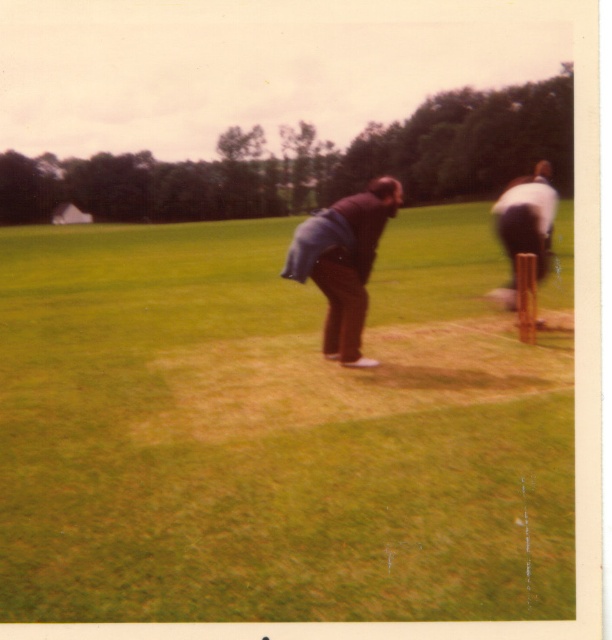
Question: Is green grass at center below white fabric shirt at right?

Choices:
 (A) yes
 (B) no

Answer: (A)

Question: Where is green grass at center located in relation to white fabric shirt at right in the image?

Choices:
 (A) above
 (B) below

Answer: (B)

Question: Is green grass at center below blue denim jacket at center?

Choices:
 (A) no
 (B) yes

Answer: (A)

Question: Among these points, which one is farthest from the camera?

Choices:
 (A) (550, 198)
 (B) (515, 358)

Answer: (A)

Question: Which point is farther from the camera taking this photo?

Choices:
 (A) (510, 184)
 (B) (280, 444)

Answer: (A)

Question: Which point is farther to the camera?

Choices:
 (A) blue denim jacket at center
 (B) green grass at center
 (C) white fabric shirt at right

Answer: (C)